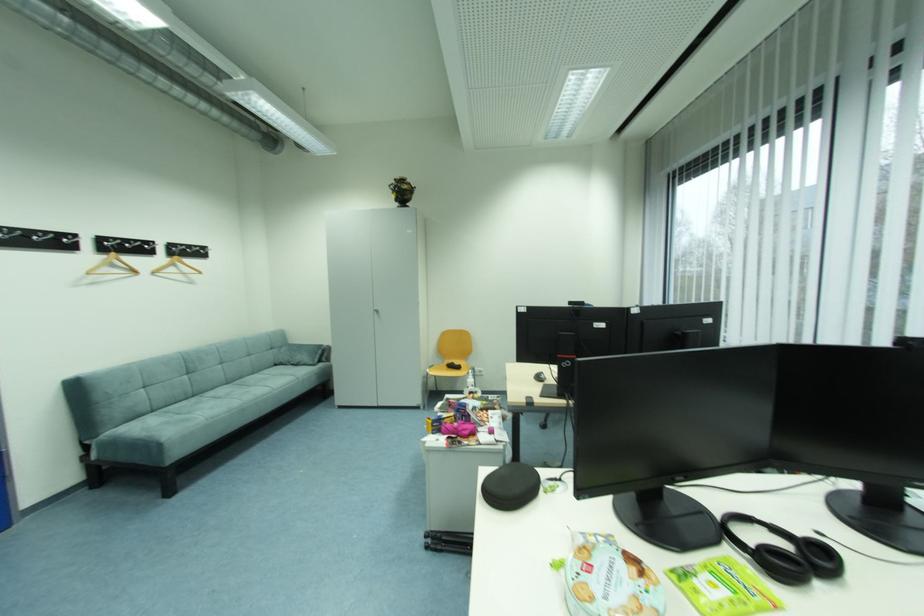
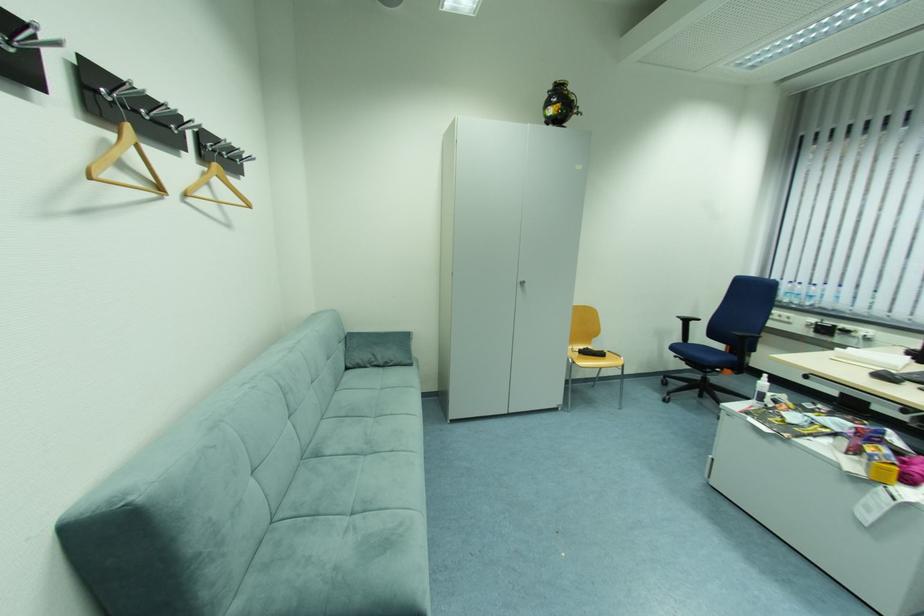
The point at (382, 310) is marked in the first image. Where is the corresponding point in the second image?

(527, 281)